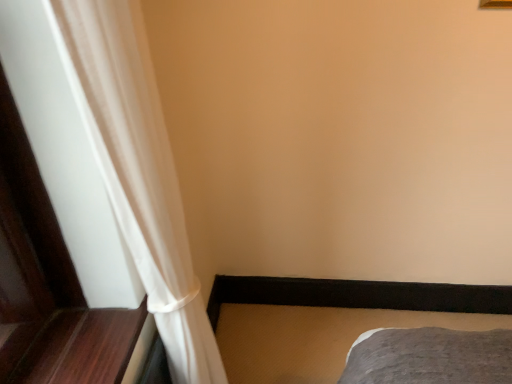
Question: In the image, is white sheer curtain at left on the left side or the right side of gray fabric bed frame at lower right?

Choices:
 (A) left
 (B) right

Answer: (A)

Question: From the image's perspective, is white sheer curtain at left positioned above or below gray fabric bed frame at lower right?

Choices:
 (A) below
 (B) above

Answer: (B)

Question: Is point (187, 316) closer or farther from the camera than point (298, 377)?

Choices:
 (A) farther
 (B) closer

Answer: (B)

Question: Considering the positions of gray fabric bed frame at lower right and white sheer curtain at left in the image, is gray fabric bed frame at lower right wider or thinner than white sheer curtain at left?

Choices:
 (A) wide
 (B) thin

Answer: (A)

Question: Does point (397, 324) appear closer or farther from the camera than point (130, 256)?

Choices:
 (A) farther
 (B) closer

Answer: (A)

Question: Considering the relative positions of gray fabric bed frame at lower right and white sheer curtain at left in the image provided, is gray fabric bed frame at lower right to the left or to the right of white sheer curtain at left?

Choices:
 (A) right
 (B) left

Answer: (A)

Question: Choose the correct answer: Is gray fabric bed frame at lower right inside white sheer curtain at left or outside it?

Choices:
 (A) outside
 (B) inside

Answer: (A)